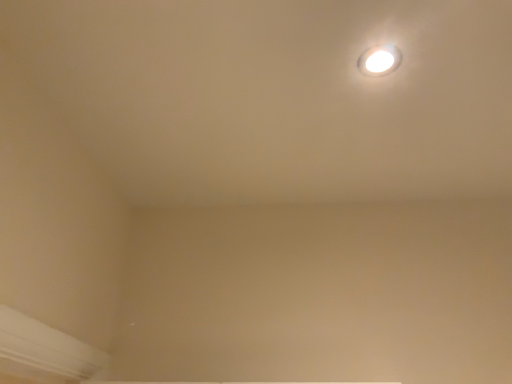
Identify the location of white glossy light fixture at upper center. This screenshot has height=384, width=512. (379, 60).

This screenshot has width=512, height=384. What do you see at coordinates (379, 60) in the screenshot? I see `white glossy light fixture at upper center` at bounding box center [379, 60].

I want to click on white glossy light fixture at upper center, so click(x=379, y=60).